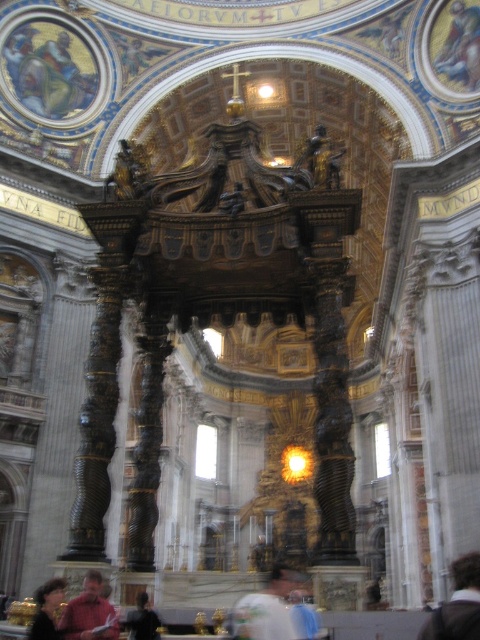
Question: Which of the following is the closest to the observer?

Choices:
 (A) (291, 621)
 (B) (99, 593)

Answer: (A)

Question: Does light brown leather jacket at lower right come behind red shirt at lower left?

Choices:
 (A) no
 (B) yes

Answer: (A)

Question: Which point is closer to the camera taking this photo?

Choices:
 (A) (475, 552)
 (B) (78, 616)
 (C) (141, 593)
 (D) (57, 588)

Answer: (B)

Question: Observing the image, what is the correct spatial positioning of dark brown hair at lower left in reference to dark brown leather jacket at lower center?

Choices:
 (A) below
 (B) above

Answer: (A)

Question: Considering the real-world distances, which object is closest to the red shirt at lower left?

Choices:
 (A) dark brown hair at lower left
 (B) light brown leather jacket at lower right
 (C) dark brown leather jacket at lower center

Answer: (A)

Question: Is red shirt at lower left positioned in front of dark brown leather jacket at lower center?

Choices:
 (A) yes
 (B) no

Answer: (A)